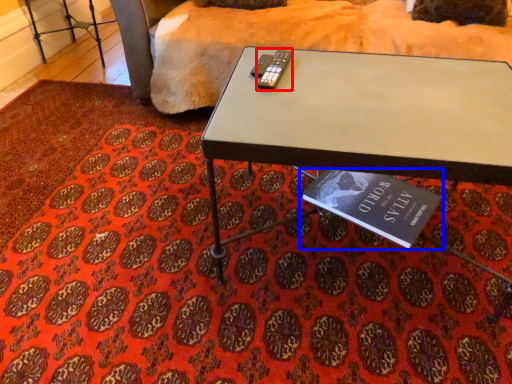
Question: Which point is closer to the camera, remote (highlighted by a red box) or book (highlighted by a blue box)?

Choices:
 (A) remote
 (B) book

Answer: (A)